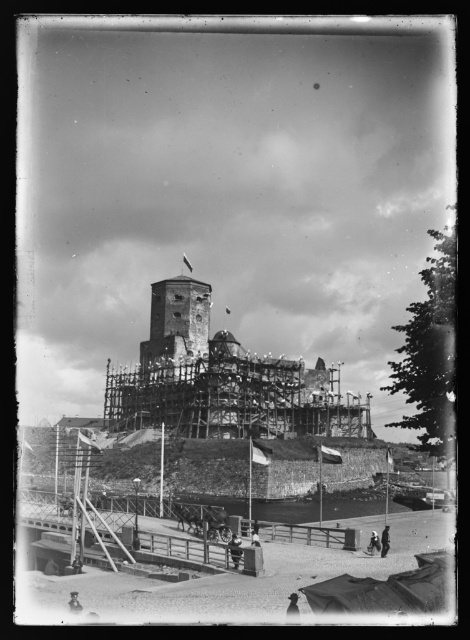
Question: Which object is closer to the camera taking this photo?

Choices:
 (A) wooden scaffolding at lower center
 (B) rusty metal tower at center

Answer: (A)

Question: Does wooden scaffolding at lower center have a larger size compared to rusty metal tower at center?

Choices:
 (A) no
 (B) yes

Answer: (B)

Question: Is wooden scaffolding at lower center further to camera compared to rusty metal tower at center?

Choices:
 (A) yes
 (B) no

Answer: (B)

Question: Which object is closer to the camera taking this photo?

Choices:
 (A) wooden scaffolding at lower center
 (B) rusty metal tower at center

Answer: (A)

Question: Does wooden scaffolding at lower center have a greater width compared to rusty metal tower at center?

Choices:
 (A) no
 (B) yes

Answer: (B)